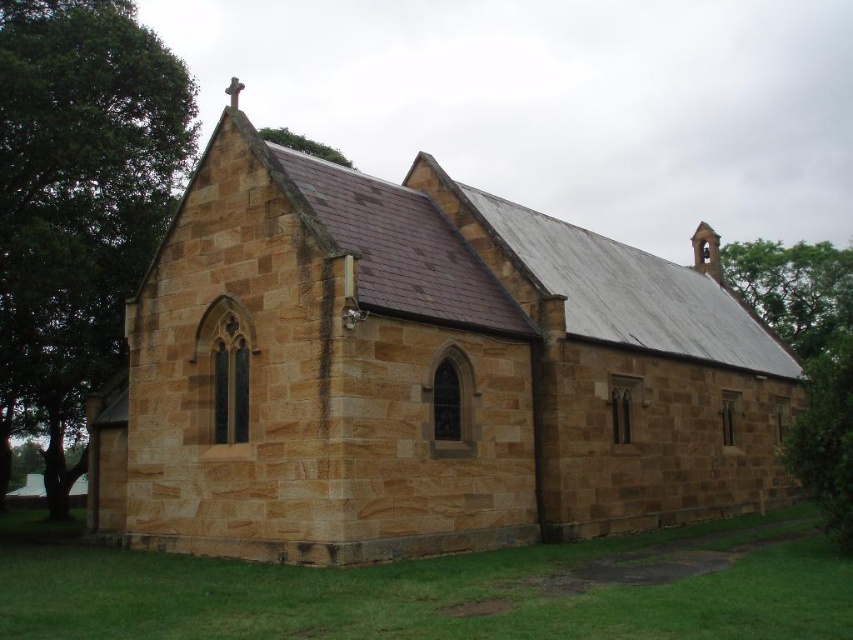
Question: Among these objects, which one is farthest from the camera?

Choices:
 (A) green leafy tree at left
 (B) green leafy tree at upper right

Answer: (A)

Question: Can you confirm if green leafy tree at left is positioned below green leafy tree at upper right?

Choices:
 (A) no
 (B) yes

Answer: (B)

Question: Considering the real-world distances, which object is closest to the brown stone church at center?

Choices:
 (A) green leafy tree at upper right
 (B) green leafy tree at left
 (C) green leafy tree at upper center

Answer: (A)

Question: Among these points, which one is farthest from the camera?

Choices:
 (A) (550, 403)
 (B) (804, 259)
 (C) (287, 132)

Answer: (B)

Question: Can you confirm if green leafy tree at left is bigger than green leafy tree at upper center?

Choices:
 (A) no
 (B) yes

Answer: (A)

Question: Can you confirm if green leafy tree at left is wider than green leafy tree at upper center?

Choices:
 (A) no
 (B) yes

Answer: (A)